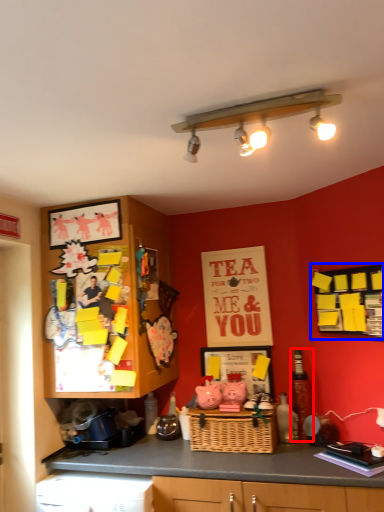
Question: Which of the following is the closest to the observer, bottle (highlighted by a red box) or bulletin board (highlighted by a blue box)?

Choices:
 (A) bottle
 (B) bulletin board

Answer: (B)